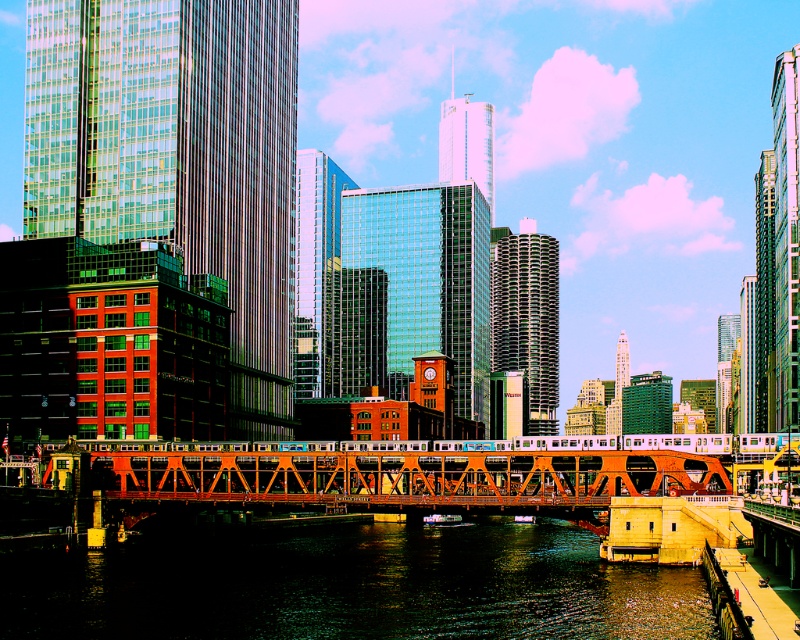
Question: Is dark reflective water at center thinner than orange metallic bridge at center?

Choices:
 (A) yes
 (B) no

Answer: (A)

Question: Is dark reflective water at center above orange metallic bridge at center?

Choices:
 (A) yes
 (B) no

Answer: (B)

Question: Which object appears closest to the camera in this image?

Choices:
 (A) dark reflective water at center
 (B) orange metallic bridge at center

Answer: (A)

Question: Can you confirm if dark reflective water at center is positioned below orange metallic bridge at center?

Choices:
 (A) yes
 (B) no

Answer: (A)